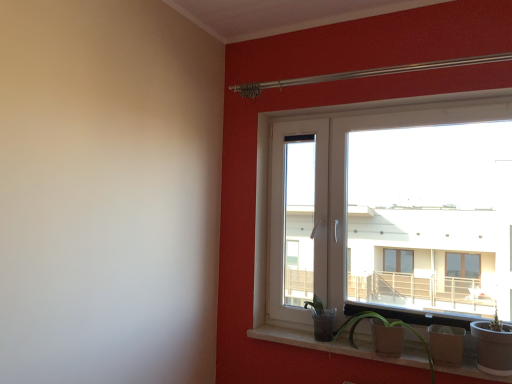
Question: Is matte concrete window sill at lower center positioned beyond the bounds of white plastic window at upper right?

Choices:
 (A) yes
 (B) no

Answer: (A)

Question: Is matte concrete window sill at lower center bigger than white plastic window at upper right?

Choices:
 (A) yes
 (B) no

Answer: (B)

Question: Is matte concrete window sill at lower center aimed at white plastic window at upper right?

Choices:
 (A) yes
 (B) no

Answer: (B)

Question: Is matte concrete window sill at lower center shorter than white plastic window at upper right?

Choices:
 (A) no
 (B) yes

Answer: (B)

Question: Does matte concrete window sill at lower center come in front of white plastic window at upper right?

Choices:
 (A) no
 (B) yes

Answer: (B)

Question: From the image's perspective, would you say matte concrete window sill at lower center is positioned over white plastic window at upper right?

Choices:
 (A) yes
 (B) no

Answer: (B)

Question: Could matte brown pot at lower right be considered to be inside matte concrete window sill at lower center?

Choices:
 (A) yes
 (B) no

Answer: (B)

Question: From the image's perspective, is matte concrete window sill at lower center on top of matte brown pot at lower right?

Choices:
 (A) no
 (B) yes

Answer: (A)

Question: Does matte concrete window sill at lower center have a smaller size compared to matte brown pot at lower right?

Choices:
 (A) yes
 (B) no

Answer: (A)

Question: Is matte concrete window sill at lower center placed right next to matte brown pot at lower right?

Choices:
 (A) no
 (B) yes

Answer: (A)

Question: Is matte concrete window sill at lower center positioned in front of matte brown pot at lower right?

Choices:
 (A) yes
 (B) no

Answer: (B)

Question: Does matte concrete window sill at lower center have a greater height compared to matte brown pot at lower right?

Choices:
 (A) no
 (B) yes

Answer: (A)

Question: Is white plastic window at upper right aimed at matte concrete window sill at lower center?

Choices:
 (A) no
 (B) yes

Answer: (A)